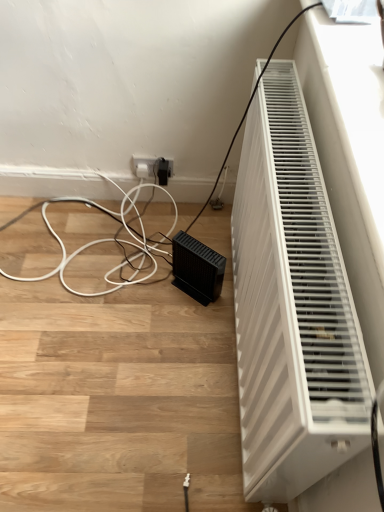
Where is `vacant space situated on the left part of black matte speaker at lower center`? vacant space situated on the left part of black matte speaker at lower center is located at coordinates (148, 282).